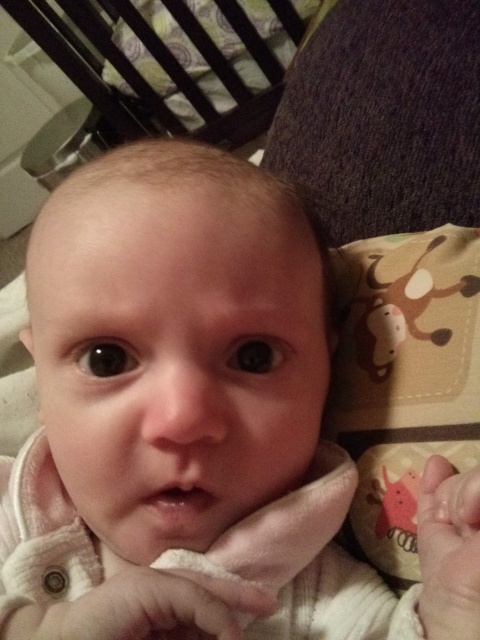
Question: Which of the following is the farthest from the observer?

Choices:
 (A) dark wood crib at upper left
 (B) soft beige fabric hand at center
 (C) pink soft hand at lower right

Answer: (A)

Question: Does dark wood crib at upper left have a smaller size compared to soft beige fabric hand at center?

Choices:
 (A) yes
 (B) no

Answer: (B)

Question: Does dark wood crib at upper left appear on the right side of soft beige fabric hand at center?

Choices:
 (A) yes
 (B) no

Answer: (B)

Question: Which object is farther from the camera taking this photo?

Choices:
 (A) pink soft hand at lower right
 (B) soft beige fabric hand at center
 (C) dark wood crib at upper left

Answer: (C)

Question: Can you confirm if dark wood crib at upper left is positioned below pink soft hand at lower right?

Choices:
 (A) no
 (B) yes

Answer: (A)

Question: Estimate the real-world distances between objects in this image. Which object is closer to the soft beige fabric hand at center?

Choices:
 (A) dark wood crib at upper left
 (B) pink soft hand at lower right

Answer: (B)